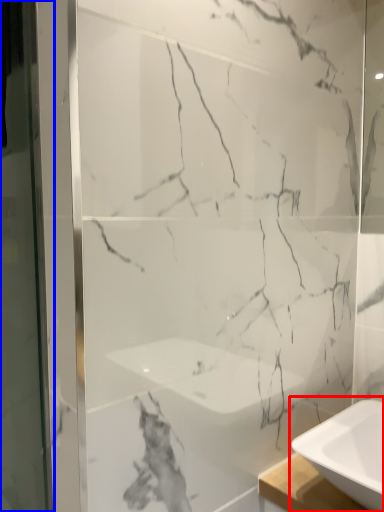
Question: Among these objects, which one is nearest to the camera, sink (highlighted by a red box) or screen door (highlighted by a blue box)?

Choices:
 (A) sink
 (B) screen door

Answer: (B)